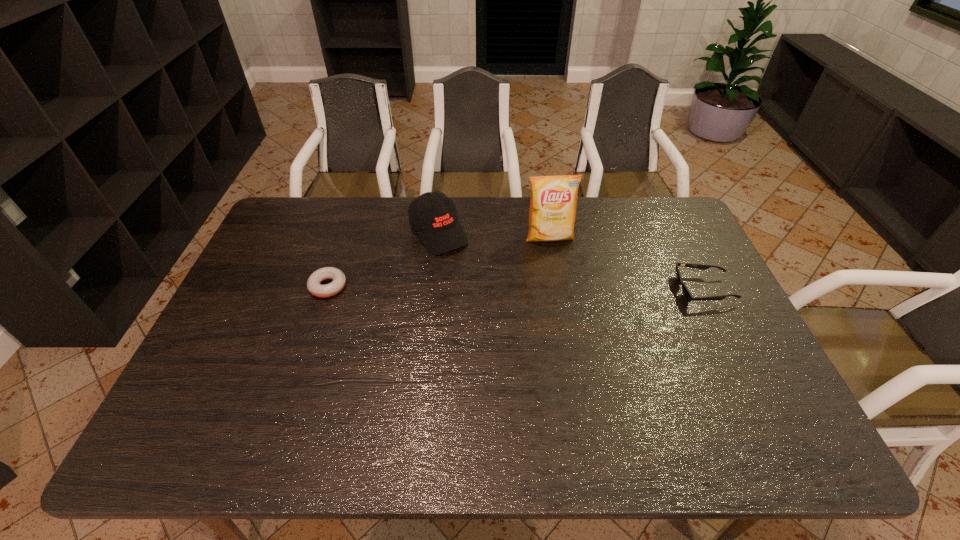
Find the location of a particular element. free spot on the desktop that is between the doughnut and the sunglasses and is positioned on the front-facing side of the second object from left to right is located at coordinates (483, 288).

The image size is (960, 540). I want to click on vacant space on the desktop that is between the leftmost object and the sunglasses and is positioned on the front-facing side of the tallest object, so click(564, 288).